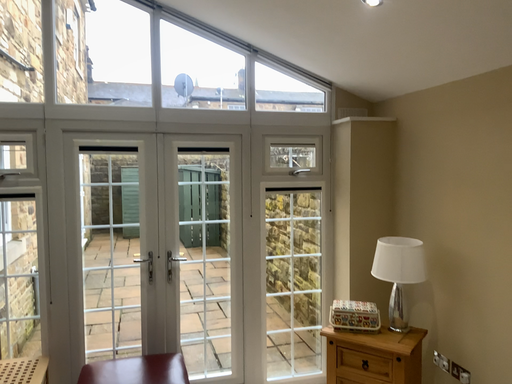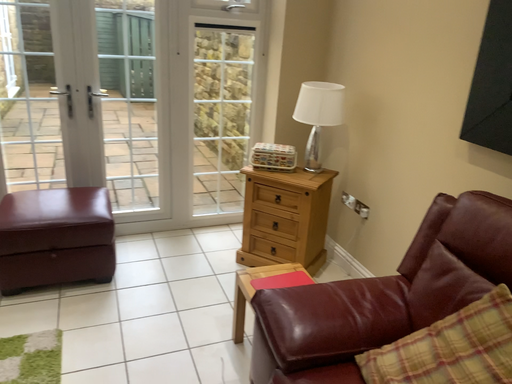
Question: How did the camera likely rotate when shooting the video?

Choices:
 (A) rotated upward
 (B) rotated downward

Answer: (B)